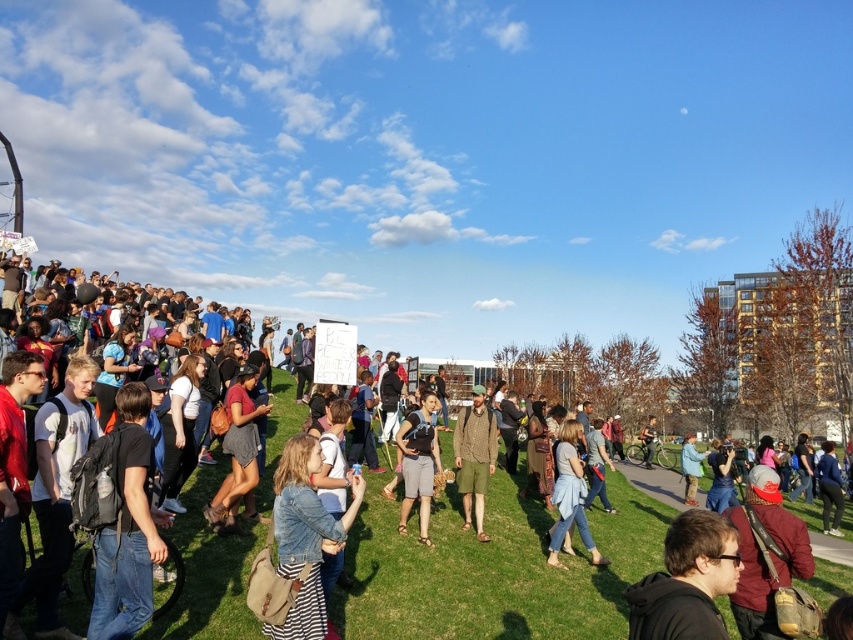
You are a photographer trying to capture a clear shot of the sign held by the person in the crowd. You notice the matte black backpack at center and the denim jacket at lower center are blocking your view. Which object is narrower and can be moved aside more easily to get a better angle?

The matte black backpack at center is thinner than the denim jacket at lower center, so it can be moved aside more easily to get a better angle.

You are standing at point (421, 481) and want to walk to the sign held by a person in the crowd. The sign is located at point (283, 524). Is the sign in front of you or behind you?

The sign at point (283, 524) is in front of you because it is located in front of point (421, 481) where you are standing.